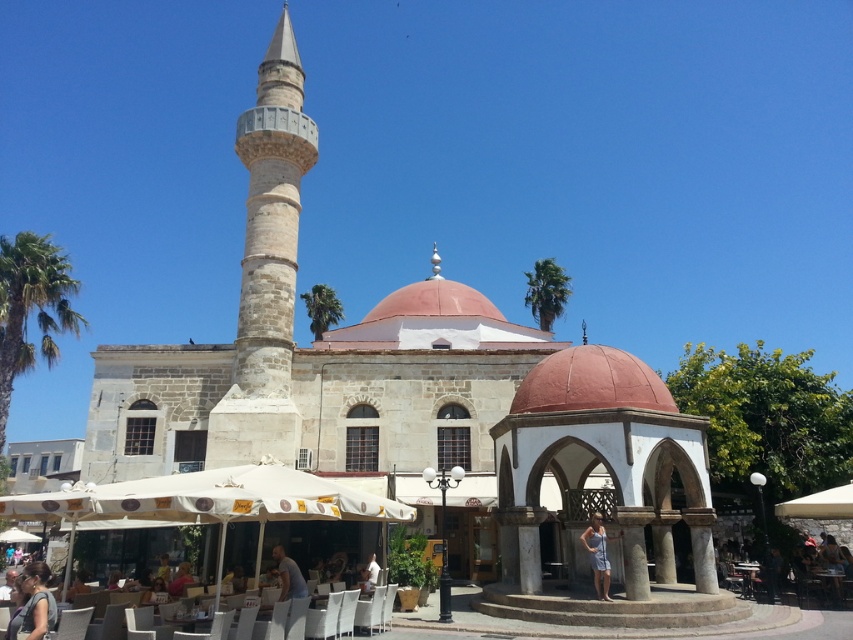
Question: Which point is closer to the camera?

Choices:
 (A) matte black hair at lower left
 (B) wooden table at center
 (C) light blue fabric shirt at lower center

Answer: (A)

Question: Which point is farther to the camera?

Choices:
 (A) blue striped dress at center
 (B) matte black hair at lower left

Answer: (A)

Question: Which is farther from the green leafy palm tree at left?

Choices:
 (A) green leafy palm tree at center
 (B) light blue fabric shirt at lower center

Answer: (A)

Question: Can you confirm if matte black hair at lower left is bigger than wooden table at center?

Choices:
 (A) no
 (B) yes

Answer: (B)

Question: Can you confirm if matte black hair at lower left is wider than light blue fabric shirt at lower center?

Choices:
 (A) no
 (B) yes

Answer: (B)

Question: Can you confirm if stone minaret at left is smaller than wooden table at center?

Choices:
 (A) yes
 (B) no

Answer: (B)